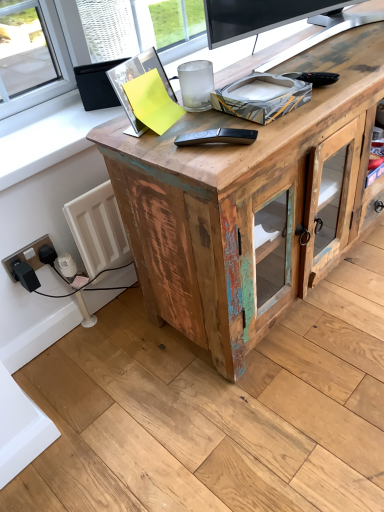
Where is `free space in front of black plastic remote control at center`? Image resolution: width=384 pixels, height=512 pixels. free space in front of black plastic remote control at center is located at coordinates (218, 161).